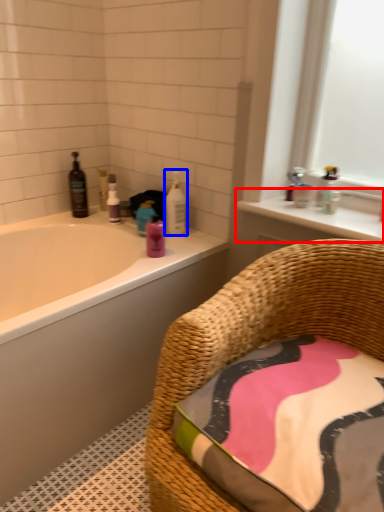
Question: Which of the following is the closest to the observer, window sill (highlighted by a red box) or cleaning product (highlighted by a blue box)?

Choices:
 (A) window sill
 (B) cleaning product

Answer: (A)